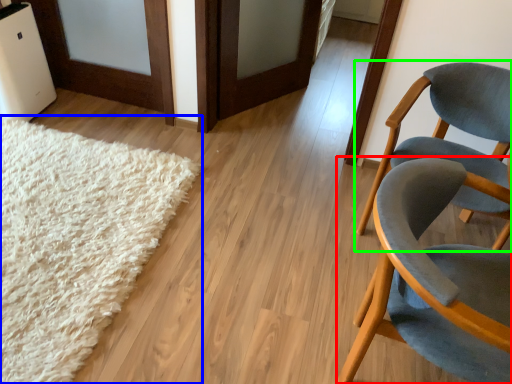
Question: Considering the real-world distances, which object is farthest from chair (highlighted by a red box)? mat (highlighted by a blue box) or chair (highlighted by a green box)?

Choices:
 (A) mat
 (B) chair

Answer: (A)